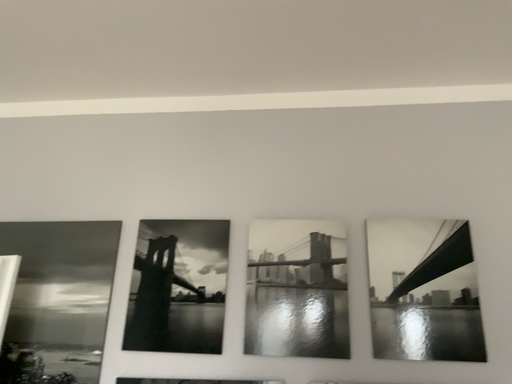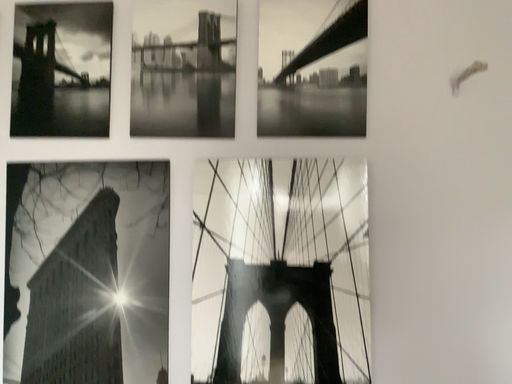
Question: Which way did the camera rotate in the video?

Choices:
 (A) rotated upward
 (B) rotated downward

Answer: (B)